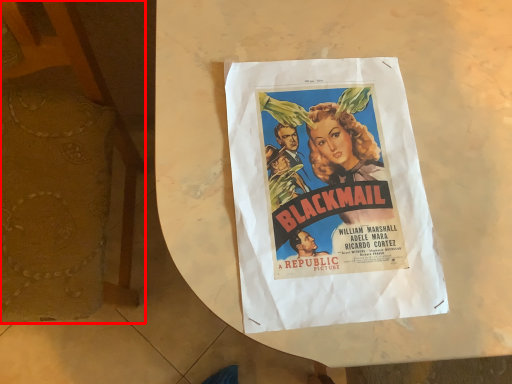
Question: From the image's perspective, what is the correct spatial relationship of armchair (annotated by the red box) in relation to poster?

Choices:
 (A) above
 (B) below

Answer: (A)